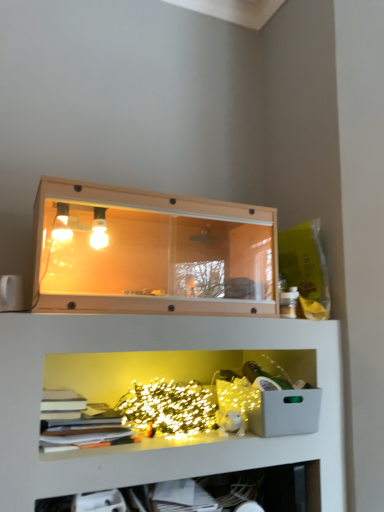
The image size is (384, 512). Describe the element at coordinates (151, 252) in the screenshot. I see `transparent wood glass box at upper center` at that location.

Where is `transparent wood glass box at upper center`? The image size is (384, 512). transparent wood glass box at upper center is located at coordinates (151, 252).

At what (x,y) coordinates should I click in order to perform the action: click on transparent wood glass box at upper center. Please return your answer as a coordinate pair (x, y). Looking at the image, I should click on (151, 252).